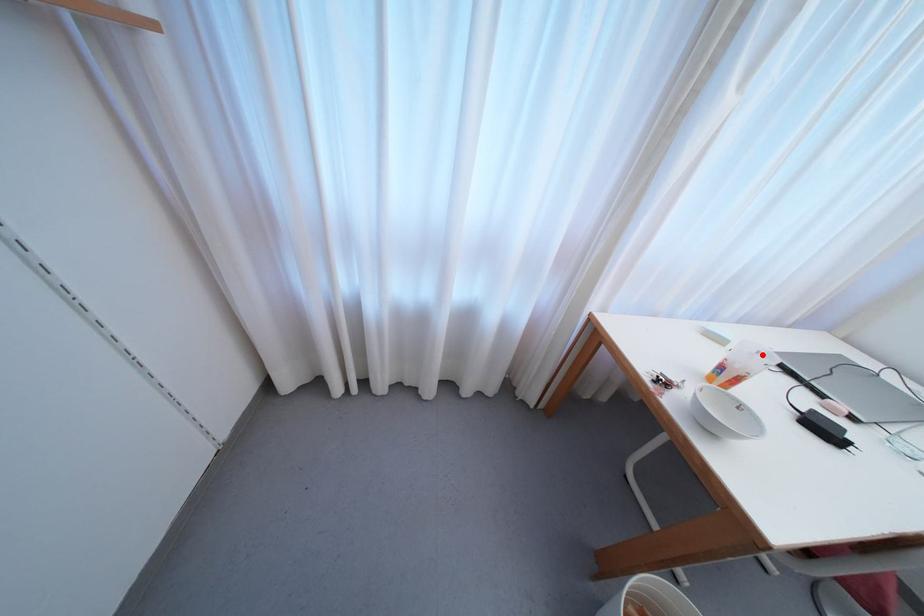
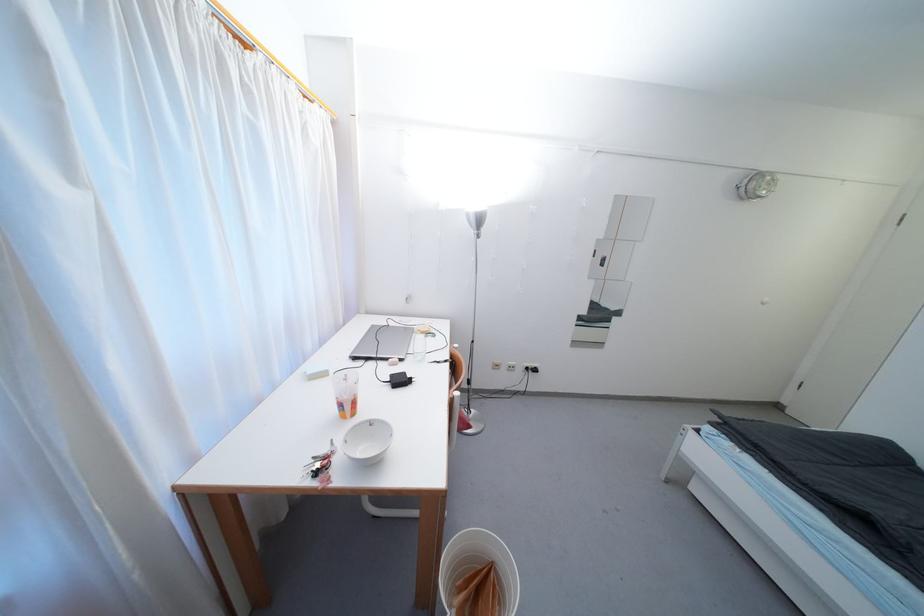
Question: I am providing you with two images of the same scene from different viewpoints. Image1 has a red point marked. In image2, the corresponding 3D location appears at what relative position? Reply with the corresponding letter.

Choices:
 (A) Closer
 (B) Farther

Answer: (A)